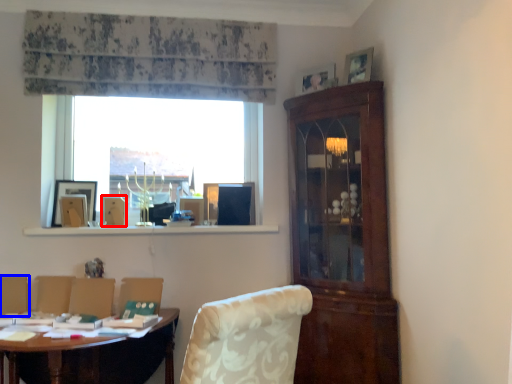
Question: Which point is closer to the camera, picture frame (highlighted by a red box) or armchair (highlighted by a blue box)?

Choices:
 (A) picture frame
 (B) armchair

Answer: (B)